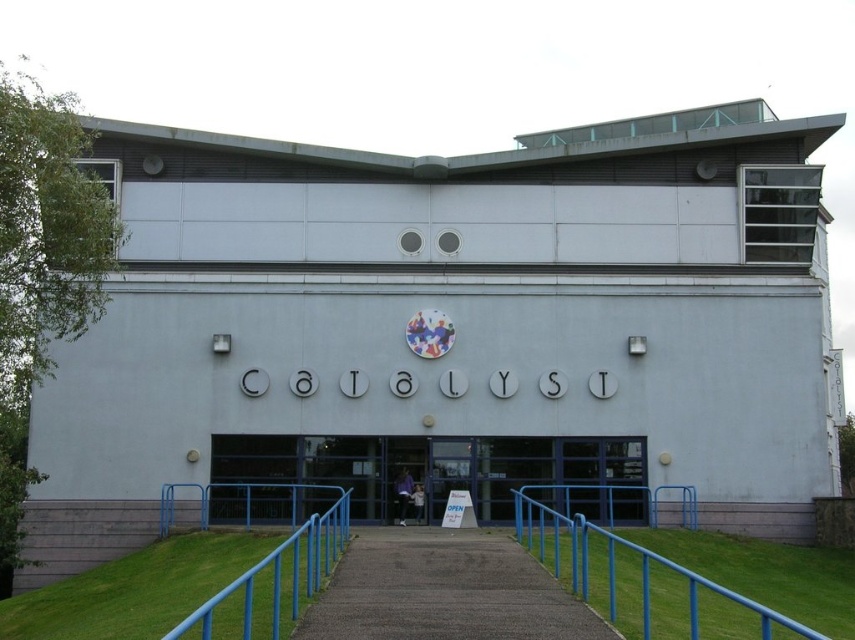
You are standing at the entrance of the Catalyst building and see the concrete paved path at center and the blue metal railing at center. Which object is positioned to the right of the other?

The concrete paved path at center is to the right of the blue metal railing at center.

You are standing at the entrance of the Catalyst building and want to locate the blue metal railing at lower center. According to the coordinates provided, where would you find it relative to your current position?

The blue metal railing at lower center is located at coordinates point (640,579), which would be to the upper right relative to your current position at the entrance.

You are standing at the entrance of the Catalyst building and want to walk to the small balcony area at the top right corner. Which direction should you take from the concrete paved path at center?

The concrete paved path at center is located at point (444,592), so you should head towards the top right direction to reach the small balcony area at the top right corner.